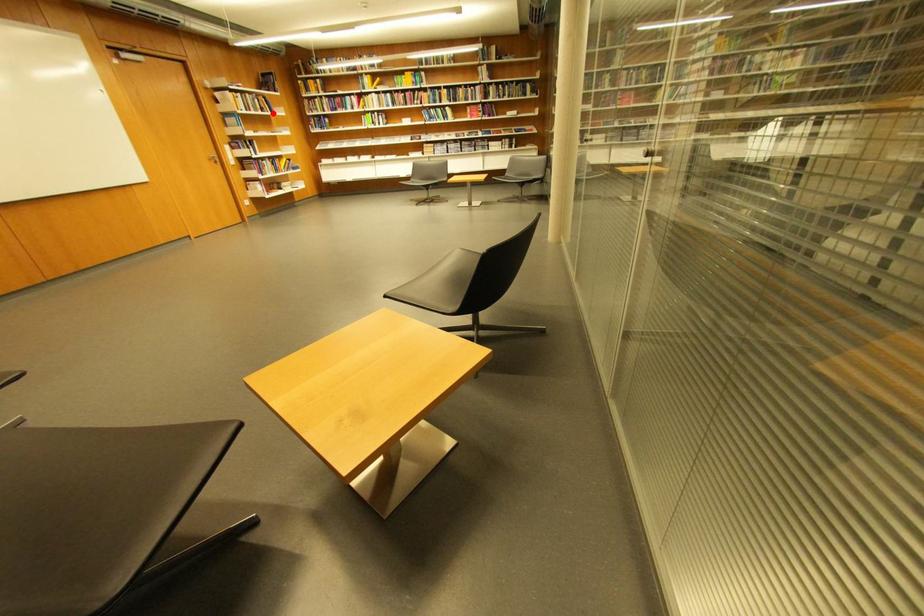
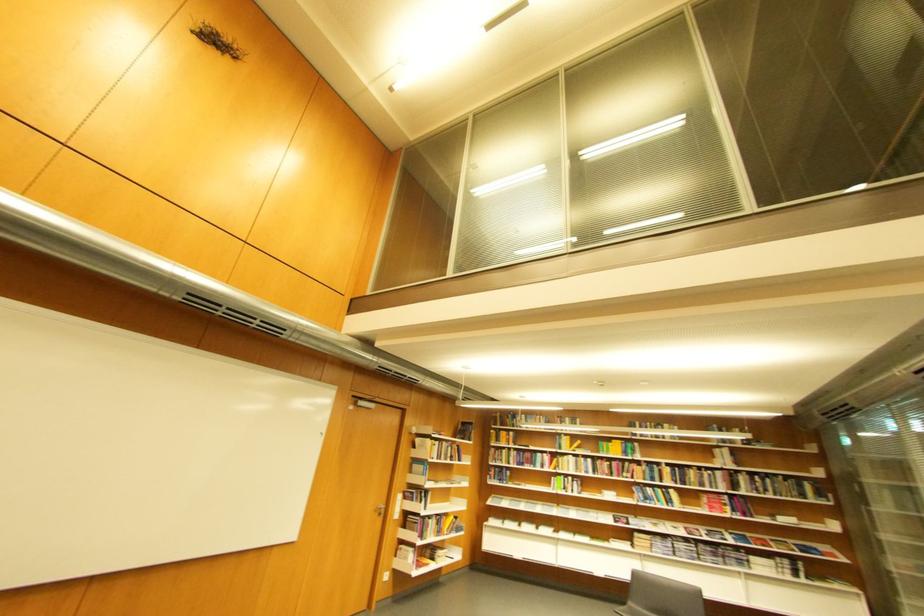
Question: A red point is marked in image1. In image2, is the corresponding 3D point closer to the camera or farther? Reply with the corresponding letter.

Choices:
 (A) The corresponding 3D point is closer.
 (B) The corresponding 3D point is farther.

Answer: (B)